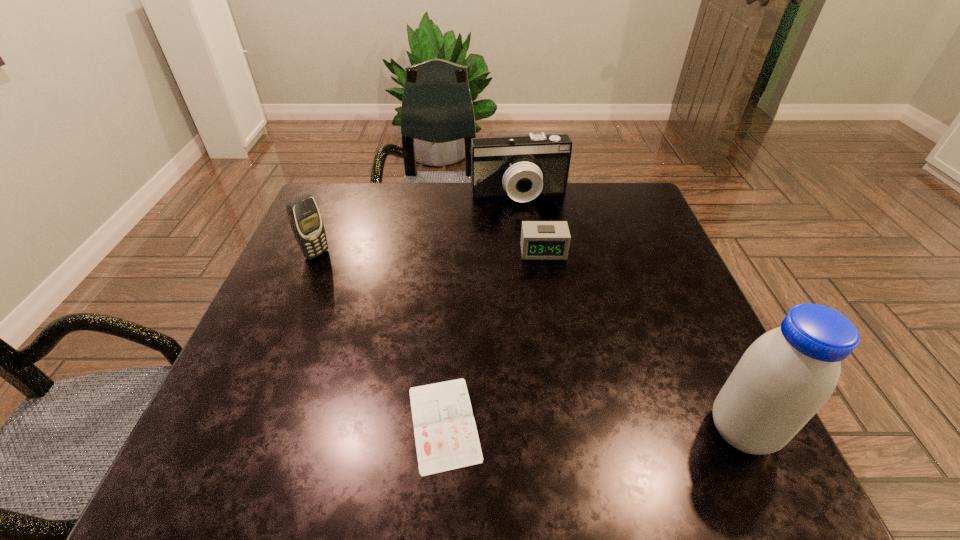
Locate an element on the screen. The image size is (960, 540). free spot on the desktop that is between the shortest object and the rightmost object and is positioned on the front-facing side of the fourth tallest object is located at coordinates (571, 427).

You are a GUI agent. You are given a task and a screenshot of the screen. Output one action in this format:
    pyautogui.click(x=<x>, y=<y>)
    Task: Click on the vacant space on the desktop that is between the shortest object and the rightmost object and is positioned on the lens of the farthest object
    The image size is (960, 540).
    Given the screenshot: What is the action you would take?
    pyautogui.click(x=588, y=427)

At what (x,y) coordinates should I click in order to perform the action: click on free space on the desktop that is between the shortest object and the soya milk and is positioned on the front face of the leftmost object. Please return your answer as a coordinate pair (x, y). The width and height of the screenshot is (960, 540). Looking at the image, I should click on (596, 427).